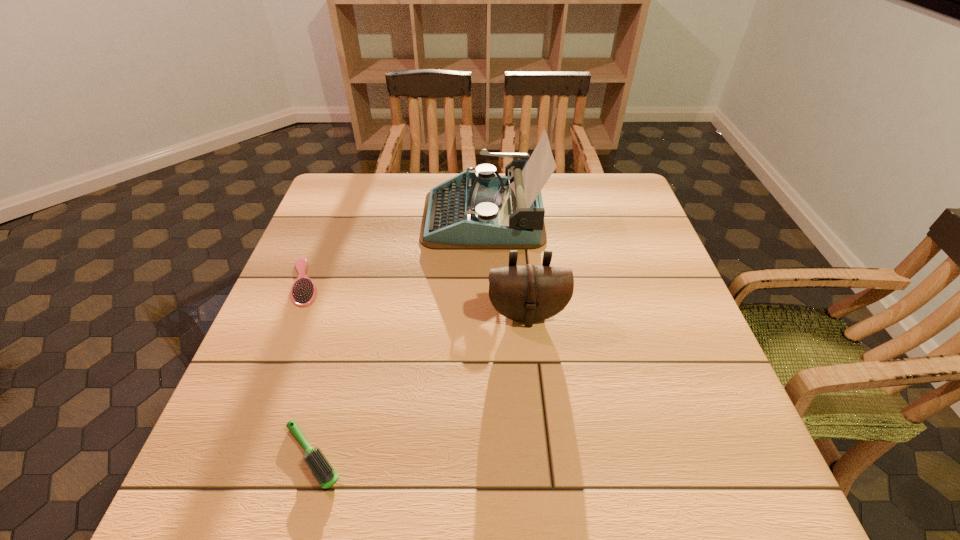
Where is `the tallest object`? Image resolution: width=960 pixels, height=540 pixels. the tallest object is located at coordinates (482, 210).

Image resolution: width=960 pixels, height=540 pixels. I want to click on the farthest object, so pyautogui.click(x=482, y=210).

You are a GUI agent. You are given a task and a screenshot of the screen. Output one action in this format:
    pyautogui.click(x=<x>, y=<y>)
    Task: Click on the second tallest object
    The image size is (960, 540).
    Given the screenshot: What is the action you would take?
    pyautogui.click(x=529, y=293)

Where is `the nearest object`? The image size is (960, 540). the nearest object is located at coordinates (326, 476).

This screenshot has height=540, width=960. I want to click on the nearer hairbrush, so click(326, 476).

Locate an element on the screen. The height and width of the screenshot is (540, 960). the farther hairbrush is located at coordinates (303, 291).

I want to click on the shorter hairbrush, so click(x=303, y=291).

Where is `vacant position located on the typing side of the typewriter`? This screenshot has height=540, width=960. vacant position located on the typing side of the typewriter is located at coordinates (367, 216).

This screenshot has width=960, height=540. I want to click on free space located on the typing side of the typewriter, so click(x=374, y=216).

Locate an element on the screen. vacant point located on the typing side of the typewriter is located at coordinates (349, 216).